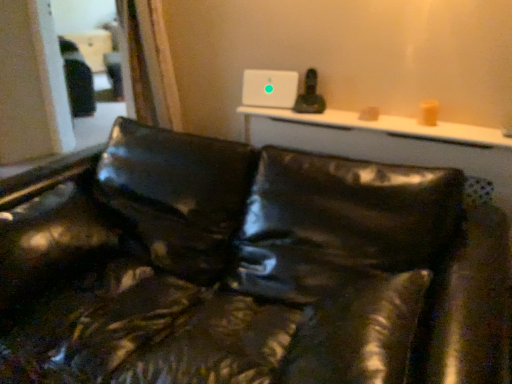
Identify the location of empty space that is ontop of white glossy table at upper center. (358, 120).